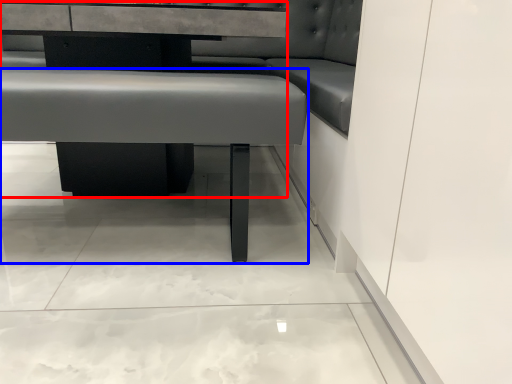
Question: Which object appears farthest to the camera in this image, table (highlighted by a red box) or vanity (highlighted by a blue box)?

Choices:
 (A) table
 (B) vanity

Answer: (A)